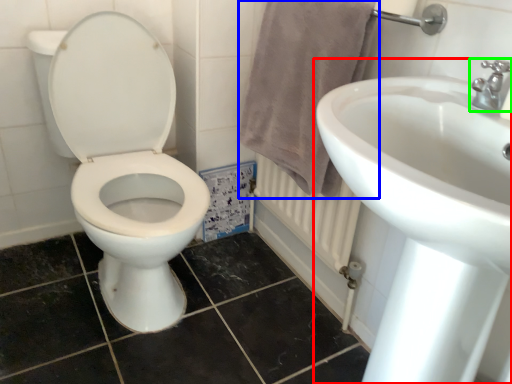
Question: Considering the real-world distances, which object is closest to sink (highlighted by a red box)? bath towel (highlighted by a blue box) or tap (highlighted by a green box).

Choices:
 (A) bath towel
 (B) tap

Answer: (B)